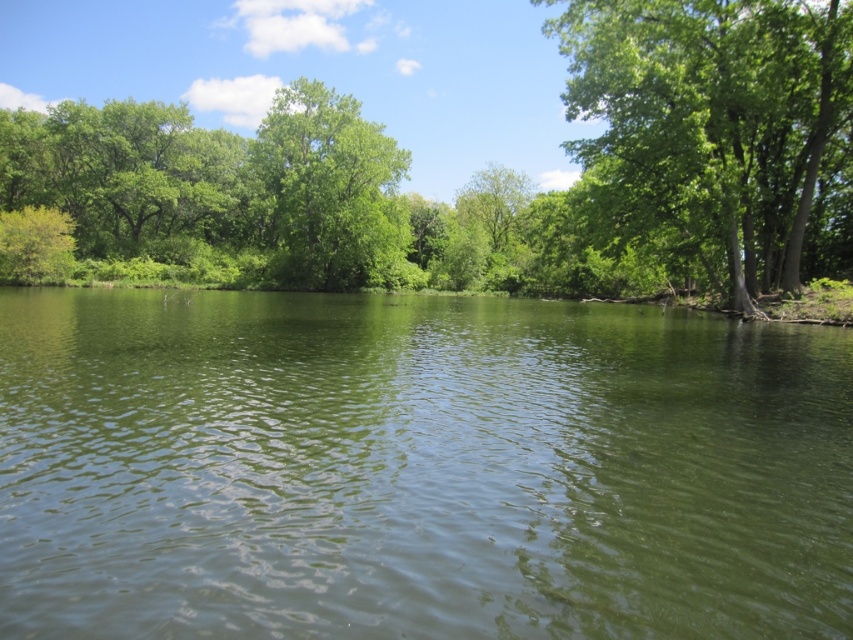
You are a painter standing in front of the landscape. You want to paint the green smooth water at center and the green leafy tree at center. Which object will you need to paint a larger area for?

The green leafy tree at center occupies more space than the green smooth water at center, so you will need to paint a larger area for the green leafy tree at center.